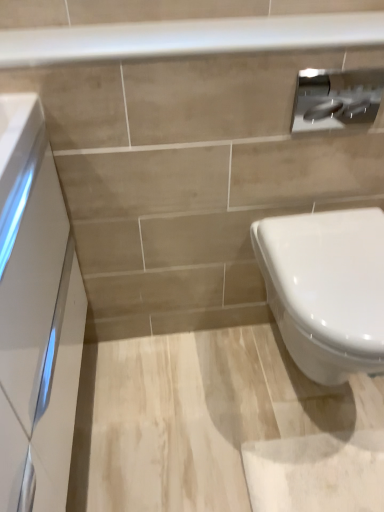
Question: Is white glossy cabinet at left in front of or behind white glossy toilet at lower right in the image?

Choices:
 (A) front
 (B) behind

Answer: (A)

Question: From their relative heights in the image, would you say white glossy cabinet at left is taller or shorter than white glossy toilet at lower right?

Choices:
 (A) short
 (B) tall

Answer: (B)

Question: Which object is the closest to the satin silver toilet paper at upper right?

Choices:
 (A) white glossy cabinet at left
 (B) white glossy toilet at lower right
 (C) white glossy balustrade at upper center

Answer: (C)

Question: Considering the real-world distances, which object is closest to the white glossy balustrade at upper center?

Choices:
 (A) white glossy toilet at lower right
 (B) white glossy cabinet at left
 (C) satin silver toilet paper at upper right

Answer: (C)